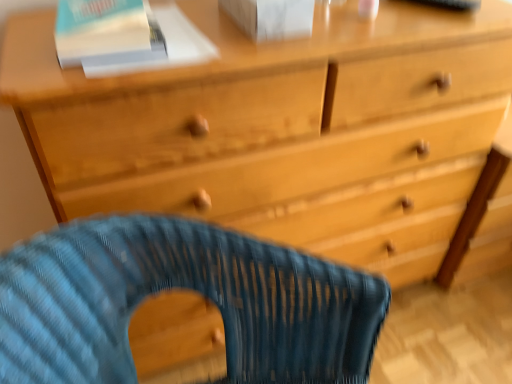
This screenshot has height=384, width=512. What do you see at coordinates (167, 46) in the screenshot?
I see `white paper at upper left, marked as the 2th paperback book in a right-to-left arrangement` at bounding box center [167, 46].

At what (x,y) coordinates should I click in order to perform the action: click on white paper at upper left, the 1th paperback book positioned from the left. Please return your answer as a coordinate pair (x, y). Image resolution: width=512 pixels, height=384 pixels. Looking at the image, I should click on (167, 46).

Which is closer to the camera, (115, 69) or (318, 320)?

The point (115, 69) is in front.

Is blue woven fabric rocking chair at lower center at the back of white paper at upper left, marked as the 2th paperback book in a right-to-left arrangement?

No, white paper at upper left, marked as the 2th paperback book in a right-to-left arrangement, is not facing away from blue woven fabric rocking chair at lower center.

From the image's perspective, which one is positioned lower, white paper at upper left, marked as the 2th paperback book in a right-to-left arrangement, or blue woven fabric rocking chair at lower center?

blue woven fabric rocking chair at lower center, from the image's perspective.

Considering the relative sizes of white paper at upper left, the 1th paperback book positioned from the left, and blue woven fabric rocking chair at lower center in the image provided, is white paper at upper left, the 1th paperback book positioned from the left, shorter than blue woven fabric rocking chair at lower center?

Correct, white paper at upper left, the 1th paperback book positioned from the left, is not as tall as blue woven fabric rocking chair at lower center.

Where is `rocking chair lying in front of the white matte paperback book at upper center, the second paperback book positioned from the left`? The width and height of the screenshot is (512, 384). rocking chair lying in front of the white matte paperback book at upper center, the second paperback book positioned from the left is located at coordinates (181, 287).

How much distance is there between white matte paperback book at upper center, the second paperback book positioned from the left, and blue woven fabric rocking chair at lower center?

A distance of 19.28 inches exists between white matte paperback book at upper center, the second paperback book positioned from the left, and blue woven fabric rocking chair at lower center.

Is white matte paperback book at upper center, the second paperback book positioned from the left, completely or partially outside of blue woven fabric rocking chair at lower center?

That's correct, white matte paperback book at upper center, the second paperback book positioned from the left, is outside of blue woven fabric rocking chair at lower center.

Is white matte paperback book at upper center, the second paperback book positioned from the left, with blue woven fabric rocking chair at lower center?

No, white matte paperback book at upper center, the second paperback book positioned from the left, is not beside blue woven fabric rocking chair at lower center.

Image resolution: width=512 pixels, height=384 pixels. I want to click on paperback book in front of the white paper at upper left, marked as the 2th paperback book in a right-to-left arrangement, so click(272, 17).

From a real-world perspective, which is physically below, white paper at upper left, marked as the 2th paperback book in a right-to-left arrangement, or white matte paperback book at upper center, the second paperback book positioned from the left?

white paper at upper left, marked as the 2th paperback book in a right-to-left arrangement, is physically lower.

Does white paper at upper left, marked as the 2th paperback book in a right-to-left arrangement, come behind white matte paperback book at upper center, which is counted as the first paperback book, starting from the right?

Yes, white paper at upper left, marked as the 2th paperback book in a right-to-left arrangement, is further from the camera.

Considering the relative sizes of white paper at upper left, marked as the 2th paperback book in a right-to-left arrangement, and white matte paperback book at upper center, the second paperback book positioned from the left, in the image provided, is white paper at upper left, marked as the 2th paperback book in a right-to-left arrangement, shorter than white matte paperback book at upper center, the second paperback book positioned from the left,?

Yes, white paper at upper left, marked as the 2th paperback book in a right-to-left arrangement, is shorter than white matte paperback book at upper center, the second paperback book positioned from the left.

Which paperback book is the 2nd one when counting from the back of the blue woven fabric rocking chair at lower center? Please provide its 2D coordinates.

[(167, 46)]

Which of these two, blue woven fabric rocking chair at lower center or white paper at upper left, marked as the 2th paperback book in a right-to-left arrangement, is thinner?

white paper at upper left, marked as the 2th paperback book in a right-to-left arrangement.

Are blue woven fabric rocking chair at lower center and white paper at upper left, marked as the 2th paperback book in a right-to-left arrangement, located far from each other?

They are positioned close to each other.

Which is closer, (x=127, y=366) or (x=145, y=64)?

Point (x=127, y=366) is farther from the camera than point (x=145, y=64).

Is white matte paperback book at upper center, the second paperback book positioned from the left, beside white paper at upper left, the 1th paperback book positioned from the left?

No, white matte paperback book at upper center, the second paperback book positioned from the left, is not next to white paper at upper left, the 1th paperback book positioned from the left.

Where is `paperback book above the white paper at upper left, marked as the 2th paperback book in a right-to-left arrangement (from the image's perspective)`? The image size is (512, 384). paperback book above the white paper at upper left, marked as the 2th paperback book in a right-to-left arrangement (from the image's perspective) is located at coordinates (272, 17).

Between white matte paperback book at upper center, the second paperback book positioned from the left, and white paper at upper left, marked as the 2th paperback book in a right-to-left arrangement, which one has larger size?

white matte paperback book at upper center, the second paperback book positioned from the left, is bigger.

How far apart are blue woven fabric rocking chair at lower center and white matte paperback book at upper center, the second paperback book positioned from the left?

19.28 inches.

Is white matte paperback book at upper center, which is counted as the first paperback book, starting from the right, inside blue woven fabric rocking chair at lower center?

That's incorrect, white matte paperback book at upper center, which is counted as the first paperback book, starting from the right, is not inside blue woven fabric rocking chair at lower center.

Is blue woven fabric rocking chair at lower center shorter than white matte paperback book at upper center, which is counted as the first paperback book, starting from the right?

No.

From a real-world perspective, is blue woven fabric rocking chair at lower center positioned above or below white matte paperback book at upper center, which is counted as the first paperback book, starting from the right?

In terms of real-world spatial position, blue woven fabric rocking chair at lower center is below white matte paperback book at upper center, which is counted as the first paperback book, starting from the right.

The width and height of the screenshot is (512, 384). What are the coordinates of `paperback book lying on the left of blue woven fabric rocking chair at lower center` in the screenshot? It's located at (167, 46).

This screenshot has height=384, width=512. I want to click on rocking chair located underneath the white matte paperback book at upper center, the second paperback book positioned from the left (from a real-world perspective), so click(x=181, y=287).

Estimate the real-world distances between objects in this image. Which object is closer to blue woven fabric rocking chair at lower center, white matte paperback book at upper center, the second paperback book positioned from the left, or white paper at upper left, the 1th paperback book positioned from the left?

white paper at upper left, the 1th paperback book positioned from the left, is positioned closer to the anchor blue woven fabric rocking chair at lower center.

Based on their spatial positions, is blue woven fabric rocking chair at lower center or white paper at upper left, marked as the 2th paperback book in a right-to-left arrangement, further from white matte paperback book at upper center, which is counted as the first paperback book, starting from the right?

The object further to white matte paperback book at upper center, which is counted as the first paperback book, starting from the right, is blue woven fabric rocking chair at lower center.

Estimate the real-world distances between objects in this image. Which object is closer to white matte paperback book at upper center, which is counted as the first paperback book, starting from the right, white paper at upper left, marked as the 2th paperback book in a right-to-left arrangement, or blue woven fabric rocking chair at lower center?

white paper at upper left, marked as the 2th paperback book in a right-to-left arrangement.

When comparing their distances from white paper at upper left, marked as the 2th paperback book in a right-to-left arrangement, does white matte paperback book at upper center, which is counted as the first paperback book, starting from the right, or blue woven fabric rocking chair at lower center seem closer?

white matte paperback book at upper center, which is counted as the first paperback book, starting from the right, is closer to white paper at upper left, marked as the 2th paperback book in a right-to-left arrangement.

Considering their positions, is blue woven fabric rocking chair at lower center positioned closer to white paper at upper left, the 1th paperback book positioned from the left, than white matte paperback book at upper center, the second paperback book positioned from the left?

Based on the image, white matte paperback book at upper center, the second paperback book positioned from the left, appears to be nearer to white paper at upper left, the 1th paperback book positioned from the left.

Considering their positions, is white paper at upper left, the 1th paperback book positioned from the left, positioned further to blue woven fabric rocking chair at lower center than white matte paperback book at upper center, the second paperback book positioned from the left?

Based on the image, white matte paperback book at upper center, the second paperback book positioned from the left, appears to be further to blue woven fabric rocking chair at lower center.

The height and width of the screenshot is (384, 512). What are the coordinates of `paperback book that lies between white matte paperback book at upper center, the second paperback book positioned from the left, and blue woven fabric rocking chair at lower center from top to bottom` in the screenshot? It's located at (167, 46).